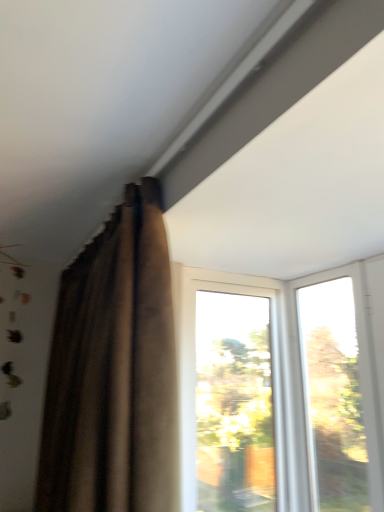
Question: Is transparent glass window at upper right, which appears as the second window when viewed from the left, surrounded by brown velvet curtain at upper left?

Choices:
 (A) no
 (B) yes

Answer: (A)

Question: Is brown velvet curtain at upper left outside transparent glass window at upper right, which ranks as the first window in right-to-left order?

Choices:
 (A) no
 (B) yes

Answer: (B)

Question: Does brown velvet curtain at upper left turn towards transparent glass window at upper right, which ranks as the first window in right-to-left order?

Choices:
 (A) no
 (B) yes

Answer: (A)

Question: Is brown velvet curtain at upper left bigger than transparent glass window at upper right, which ranks as the first window in right-to-left order?

Choices:
 (A) yes
 (B) no

Answer: (A)

Question: Is brown velvet curtain at upper left turned away from transparent glass window at upper right, which ranks as the first window in right-to-left order?

Choices:
 (A) yes
 (B) no

Answer: (A)

Question: From a real-world perspective, is brown velvet curtain at upper left positioned over transparent glass window at upper right, which ranks as the first window in right-to-left order, based on gravity?

Choices:
 (A) no
 (B) yes

Answer: (B)

Question: Is brown velvet curtain at upper left facing away from transparent glass window at center, placed as the 2th window when sorted from right to left?

Choices:
 (A) no
 (B) yes

Answer: (B)

Question: Is brown velvet curtain at upper left not close to transparent glass window at center, which appears as the first window when viewed from the left?

Choices:
 (A) no
 (B) yes

Answer: (A)

Question: Can you confirm if brown velvet curtain at upper left is wider than transparent glass window at center, placed as the 2th window when sorted from right to left?

Choices:
 (A) yes
 (B) no

Answer: (A)

Question: Does brown velvet curtain at upper left have a lesser width compared to transparent glass window at center, which appears as the first window when viewed from the left?

Choices:
 (A) no
 (B) yes

Answer: (A)

Question: Considering the relative sizes of brown velvet curtain at upper left and transparent glass window at center, which appears as the first window when viewed from the left, in the image provided, is brown velvet curtain at upper left taller than transparent glass window at center, which appears as the first window when viewed from the left,?

Choices:
 (A) yes
 (B) no

Answer: (A)

Question: Does brown velvet curtain at upper left appear on the left side of transparent glass window at center, placed as the 2th window when sorted from right to left?

Choices:
 (A) no
 (B) yes

Answer: (B)

Question: Considering the relative positions of transparent glass window at upper right, which ranks as the first window in right-to-left order, and transparent glass window at center, which appears as the first window when viewed from the left, in the image provided, is transparent glass window at upper right, which ranks as the first window in right-to-left order, to the right of transparent glass window at center, which appears as the first window when viewed from the left, from the viewer's perspective?

Choices:
 (A) yes
 (B) no

Answer: (A)